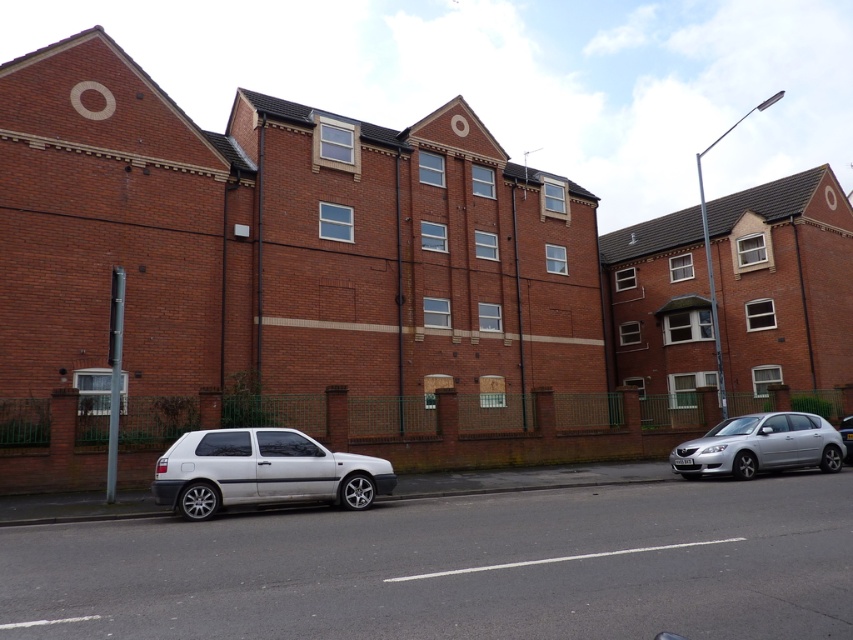
The width and height of the screenshot is (853, 640). I want to click on white matte hatchback at lower left, so click(x=262, y=472).

Who is taller, white matte hatchback at lower left or silver metallic car at right?

With more height is white matte hatchback at lower left.

Between point (173, 445) and point (845, 460), which one is positioned behind?

The point (845, 460) is behind.

Image resolution: width=853 pixels, height=640 pixels. Find the location of `white matte hatchback at lower left`. white matte hatchback at lower left is located at coordinates (262, 472).

Between white matte hatchback at lower left and silver metallic hatchback at right, which one appears on the right side from the viewer's perspective?

silver metallic hatchback at right is more to the right.

Is point (271, 481) positioned after point (718, 433)?

No, (271, 481) is closer to viewer.

The image size is (853, 640). I want to click on white matte hatchback at lower left, so click(262, 472).

Is point (734, 417) closer to camera compared to point (850, 428)?

No, it is behind (850, 428).

This screenshot has width=853, height=640. What do you see at coordinates (759, 445) in the screenshot? I see `silver metallic hatchback at right` at bounding box center [759, 445].

Find the location of a particular element. silver metallic hatchback at right is located at coordinates (759, 445).